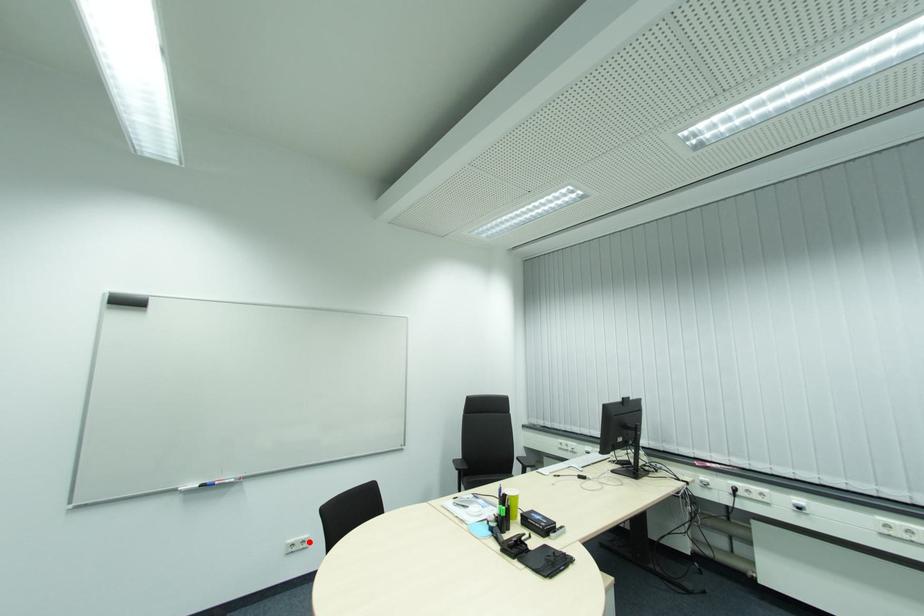
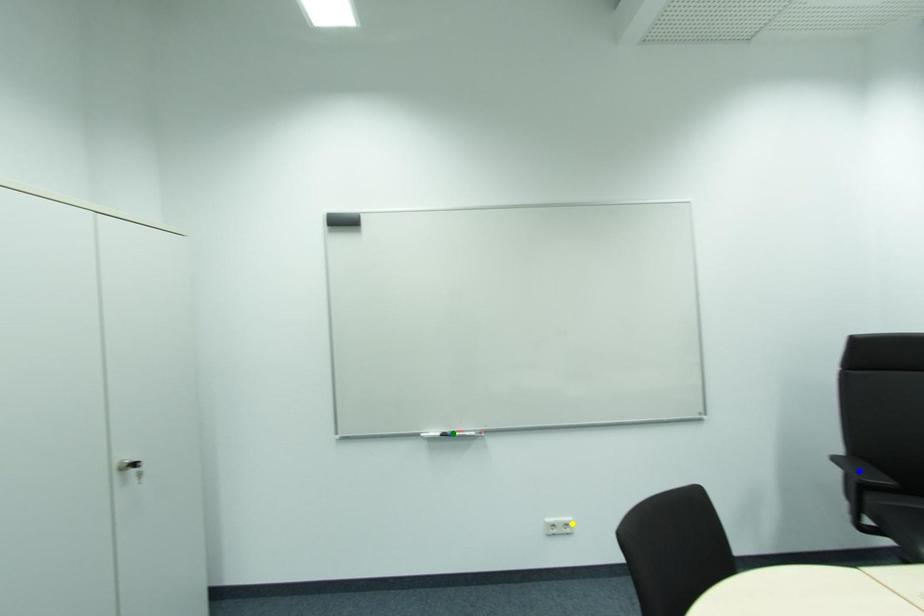
Question: I am providing you with two images of the same scene from different viewpoints. A red point is marked on the first image. You are given multiple points on the second image. In image 2, which mark is for the same physical point as the one in image 1?

Choices:
 (A) yellow point
 (B) blue point
 (C) green point

Answer: (A)